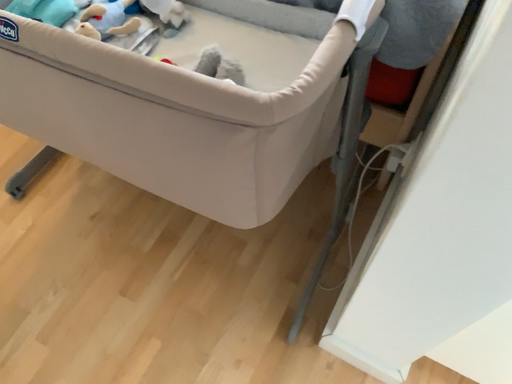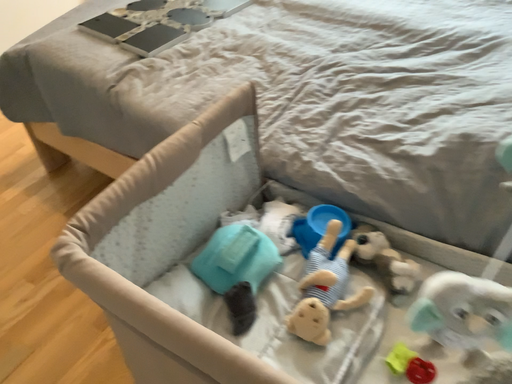
Question: How did the camera likely rotate when shooting the video?

Choices:
 (A) rotated downward
 (B) rotated upward

Answer: (B)